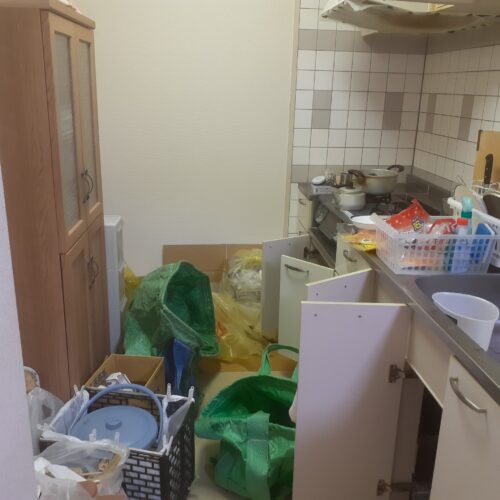
Locate an element on the screen. This screenshot has width=500, height=500. floor is located at coordinates (350, 192), (383, 173), (193, 488).